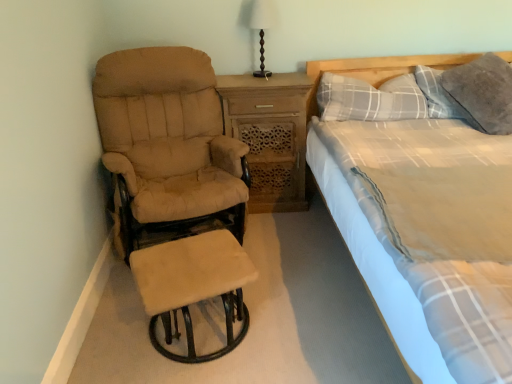
Identify the location of vacant space underneath beige suede stool at lower left (from a real-world perspective). (201, 337).